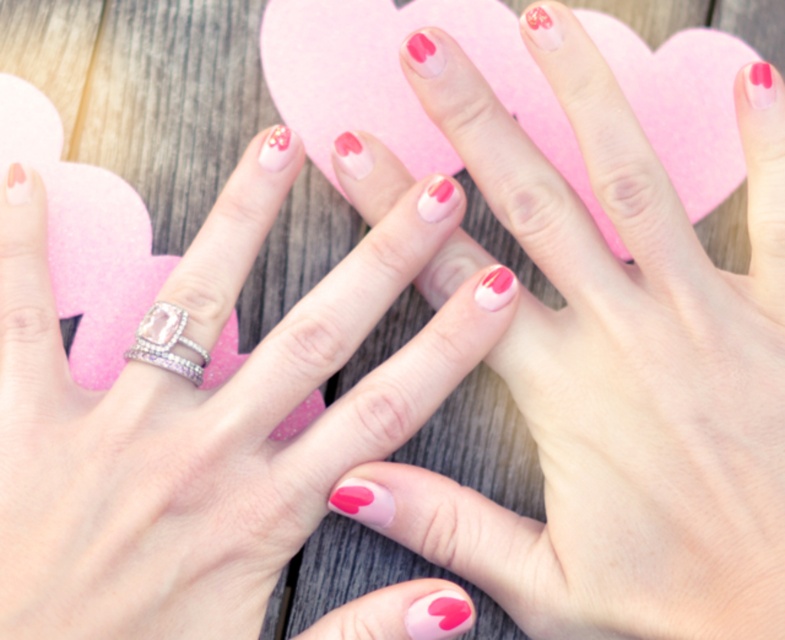
Question: Is matte pink nail polish at center bigger than clear crystal ring at center?

Choices:
 (A) no
 (B) yes

Answer: (B)

Question: Which point is farther to the camera?

Choices:
 (A) clear crystal ring at center
 (B) matte pink nail polish at center
 (C) pink matte nails at center
 (D) pink matte heart at center

Answer: (D)

Question: Which point is farther from the camera taking this photo?

Choices:
 (A) (400, 474)
 (B) (130, 355)

Answer: (A)

Question: Does pink matte nails at center appear on the left side of matte pink nail polish at center?

Choices:
 (A) no
 (B) yes

Answer: (A)

Question: Which object appears closest to the camera in this image?

Choices:
 (A) pink matte nails at center
 (B) clear crystal ring at center
 (C) matte pink nail polish at center
 (D) pink matte heart at center

Answer: (C)

Question: Observing the image, what is the correct spatial positioning of matte pink nail polish at center in reference to pink matte heart at center?

Choices:
 (A) right
 (B) left

Answer: (B)